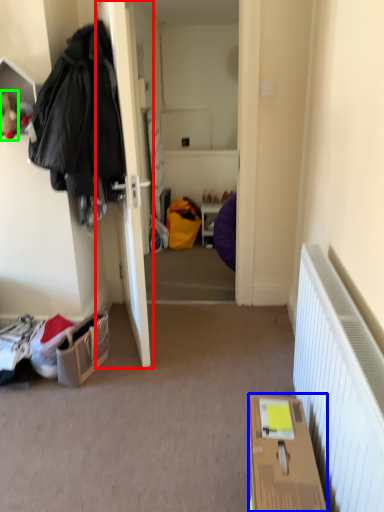
Question: Based on their relative distances, which object is farther from door (highlighted by a red box)? Choose from box (highlighted by a blue box) and toy (highlighted by a green box).

Choices:
 (A) box
 (B) toy

Answer: (A)